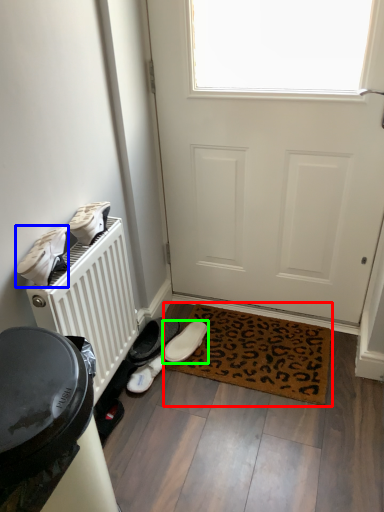
Question: Which is nearer to the mat (highlighted by a red box)? footwear (highlighted by a blue box) or footwear (highlighted by a green box).

Choices:
 (A) footwear
 (B) footwear

Answer: (B)